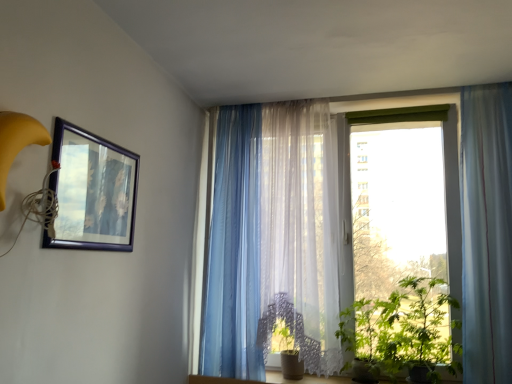
Question: In terms of size, does green leafy plant at lower right appear bigger or smaller than translucent blue curtain at center, which is counted as the 1th curtain, starting from the left?

Choices:
 (A) small
 (B) big

Answer: (A)

Question: Considering the relative positions of green leafy plant at lower right and translucent blue curtain at center, arranged as the third curtain when viewed from the right, in the image provided, is green leafy plant at lower right to the left or to the right of translucent blue curtain at center, arranged as the third curtain when viewed from the right,?

Choices:
 (A) right
 (B) left

Answer: (A)

Question: Which object is positioned closest to the translucent blue curtain at right, the 1th curtain in the right-to-left sequence?

Choices:
 (A) green leafy plant at lower right
 (B) matte black picture frame at upper left
 (C) green leafy plant at right
 (D) translucent blue curtain at center, which is counted as the 1th curtain, starting from the left
 (E) translucent fabric curtain at center, the second curtain viewed from the right

Answer: (C)

Question: Which object is the closest to the green leafy plant at lower right?

Choices:
 (A) translucent blue curtain at right, the 1th curtain in the right-to-left sequence
 (B) green leafy plant at right
 (C) matte black picture frame at upper left
 (D) translucent blue curtain at center, which is counted as the 1th curtain, starting from the left
 (E) translucent fabric at center

Answer: (B)